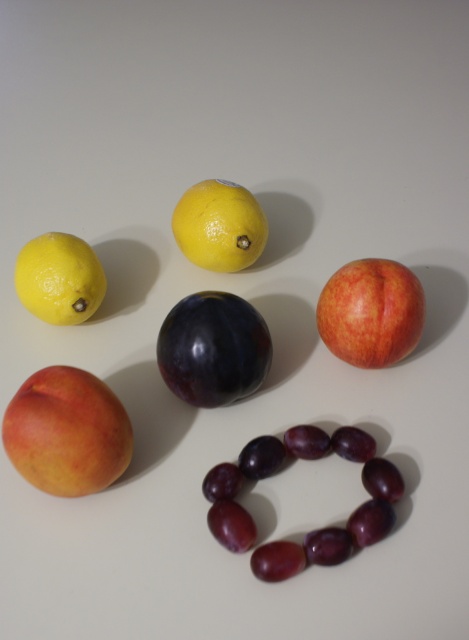
You are arranging fruits on a table and need to place a matte peach at upper right and a yellow matte lemon at center. Which fruit should you place first if you want the taller one to be on top?

The matte peach at upper right is taller than the yellow matte lemon at center, so you should place the matte peach at upper right first to have it on top.

You are arranging fruits on a table and have a shiny dark purple plum at center and a matte yellow lemon at upper left. Which fruit has a smoother surface?

The shiny dark purple plum at center has a smoother surface than the matte yellow lemon at upper left.

You are arranging fruits on a table and notice the shiny dark purple plum at center and the matte yellow lemon at upper left. Which fruit is positioned higher up in the arrangement?

The matte yellow lemon at upper left is positioned higher up than the shiny dark purple plum at center.